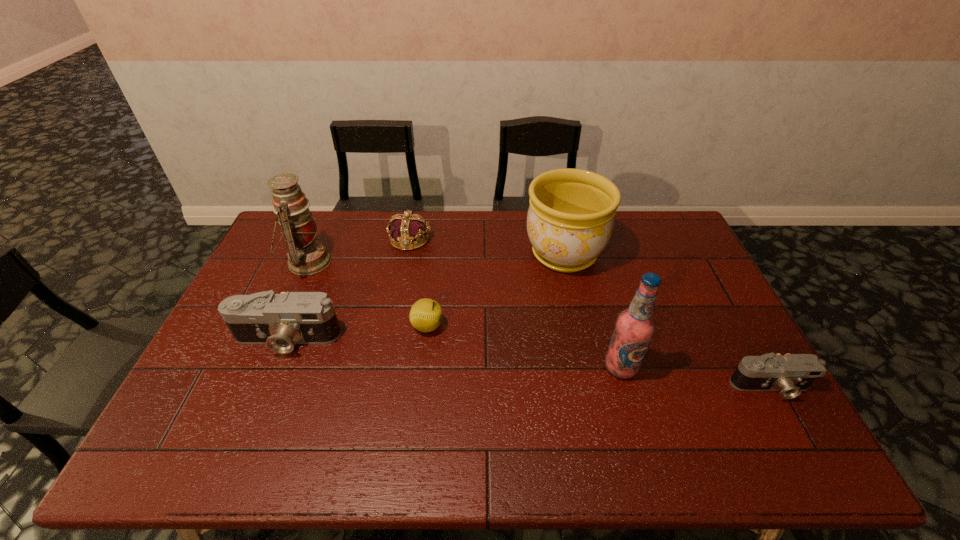
I want to click on vacant region that satisfies the following two spatial constraints: 1. on the back side of the flowerpot; 2. on the left side of the oil lamp, so click(311, 254).